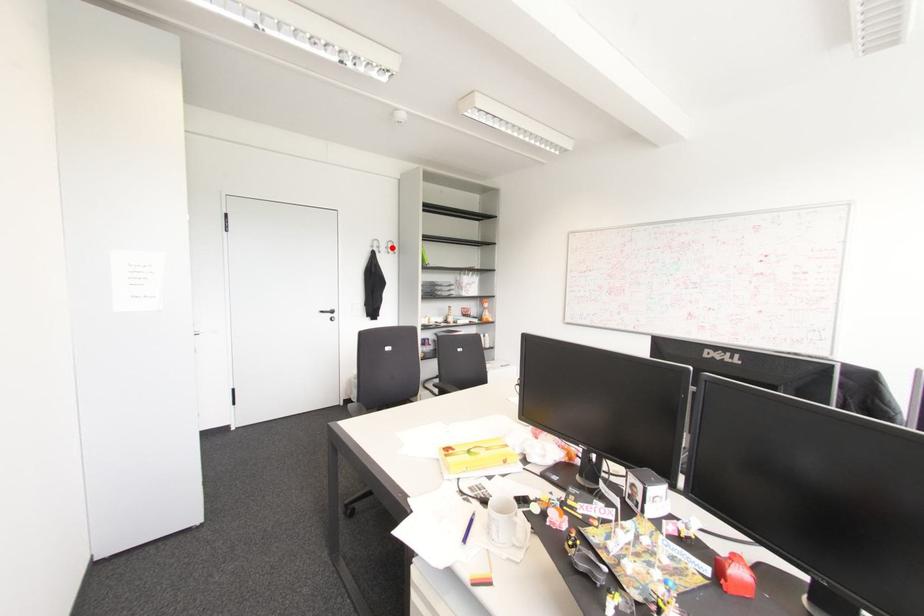
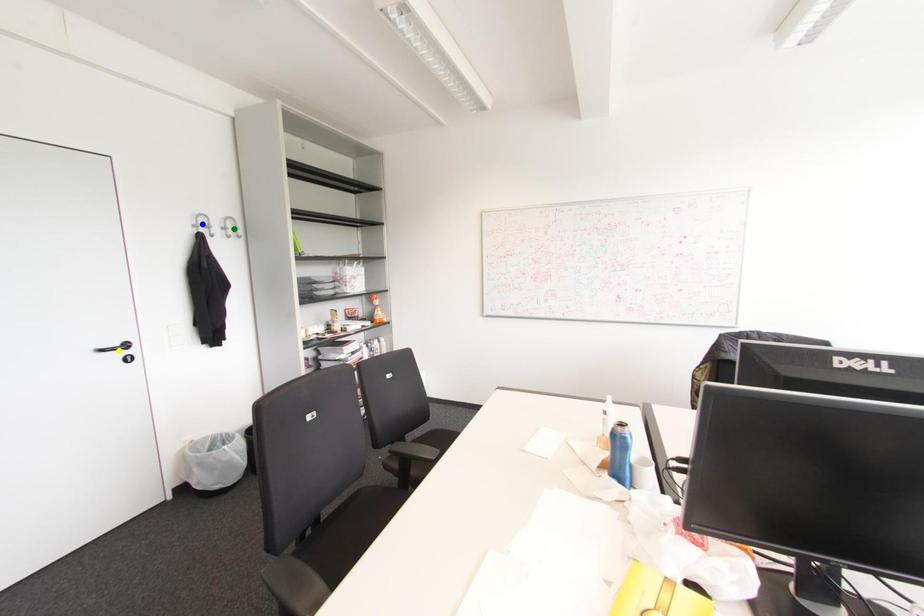
Question: I am providing you with two images of the same scene from different viewpoints. A red point is marked on the first image. You are given multiple points on the second image. In image 2, which mark is for the same physical point as the one in image 1?

Choices:
 (A) green point
 (B) blue point
 (C) yellow point

Answer: (A)